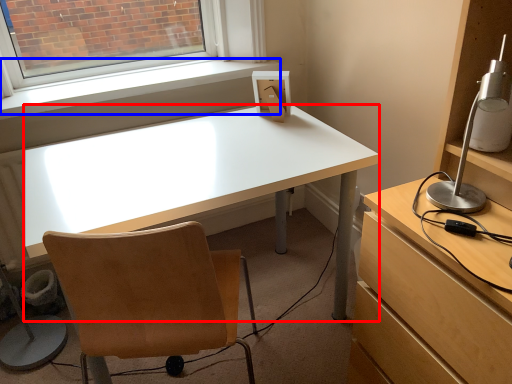
Question: Which object is further to the camera taking this photo, desk (highlighted by a red box) or window sill (highlighted by a blue box)?

Choices:
 (A) desk
 (B) window sill

Answer: (B)